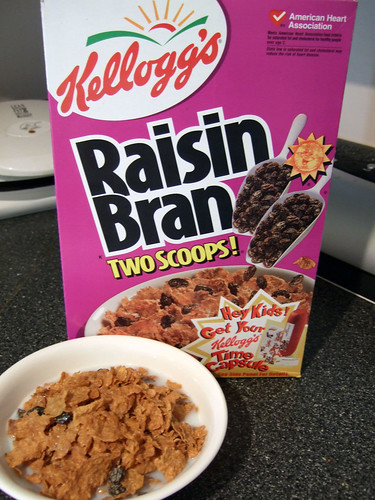
You are a GUI agent. You are given a task and a screenshot of the screen. Output one action in this format:
    pyautogui.click(x=<x>, y=<y>)
    Task: Click on the floor
    
    Given the screenshot: What is the action you would take?
    pyautogui.click(x=282, y=408)